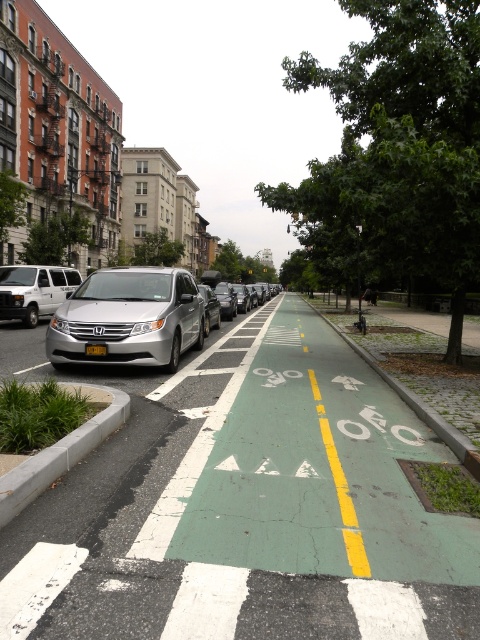
Is point (184, 452) farther from viewer compared to point (420, 410)?

No, it is not.

Between green painted bike lane at center and green concrete curb at center, which one appears on the right side from the viewer's perspective?

green concrete curb at center

Identify the location of green painted bike lane at center. (248, 508).

This screenshot has height=640, width=480. What are the coordinates of `green painted bike lane at center` in the screenshot? It's located at [248, 508].

Which is above, silver metallic van at center or green concrete curb at center?

silver metallic van at center is above.

Is point (87, 352) closer to viewer compared to point (385, 371)?

Yes, it is.

Where is `silver metallic van at center`? This screenshot has width=480, height=640. silver metallic van at center is located at coordinates coord(128,317).

Is green painted bike lane at center closer to camera compared to gray concrete curb at lower left?

Yes, it is.

Find the location of a particular element. The image size is (480, 640). green painted bike lane at center is located at coordinates (248, 508).

You are a GUI agent. You are given a task and a screenshot of the screen. Output one action in this format:
    pyautogui.click(x=<x>, y=<y>)
    Task: Click on the green painted bike lane at center
    The width and height of the screenshot is (480, 640).
    Given the screenshot: What is the action you would take?
    pyautogui.click(x=248, y=508)